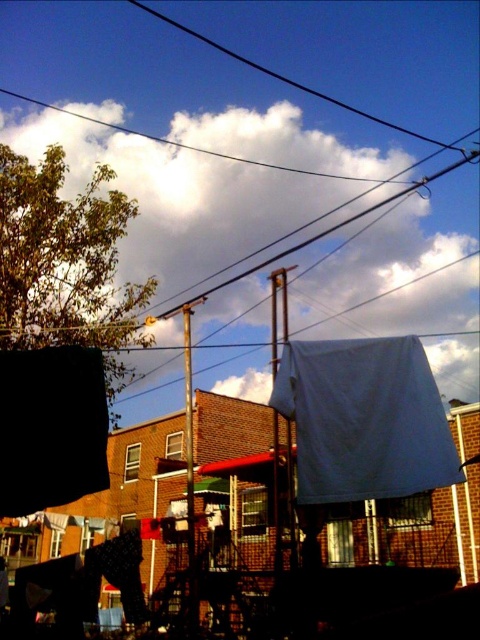
You are standing on the residential street and see the white fabric at center and the white fabric at upper center. Which one is shorter in height?

The white fabric at center has a lesser height compared to white fabric at upper center, so the white fabric at center is shorter.

Consider the image. You are a window cleaner standing on a ladder looking at the scene. You need to clean both the white fabric at upper center and the black wire at upper center. Which object requires you to move the ladder further to the right to reach its full width?

The white fabric at upper center requires moving the ladder further to the right because its width surpasses that of the black wire at upper center, meaning it extends farther to the right side.